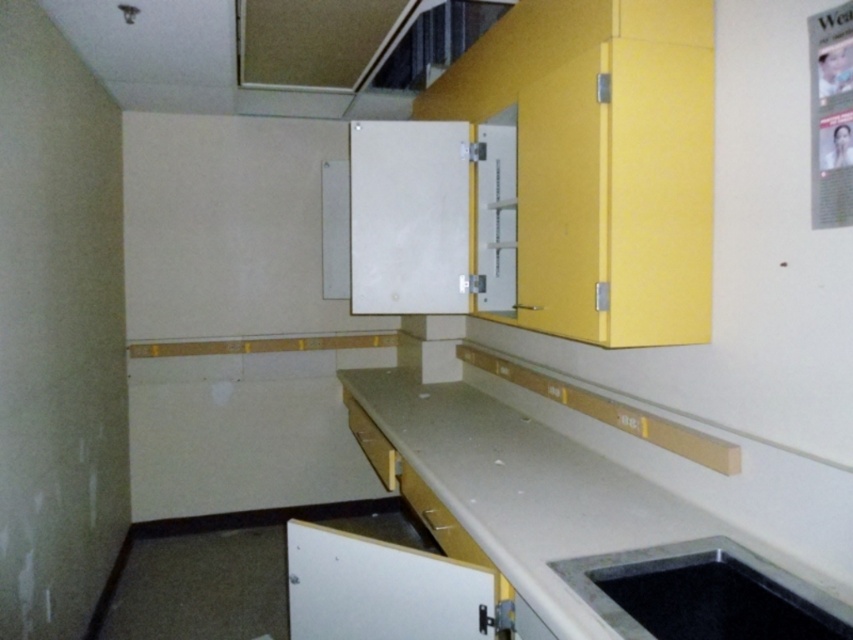
Does point (666, 536) come closer to viewer compared to point (828, 600)?

No.

Between point (505, 449) and point (706, 580), which one is positioned behind?

The point (505, 449) is more distant.

Between point (827, 541) and point (773, 605), which one is positioned behind?

The point (827, 541) is more distant.

I want to click on white laminate countertop at center, so click(602, 518).